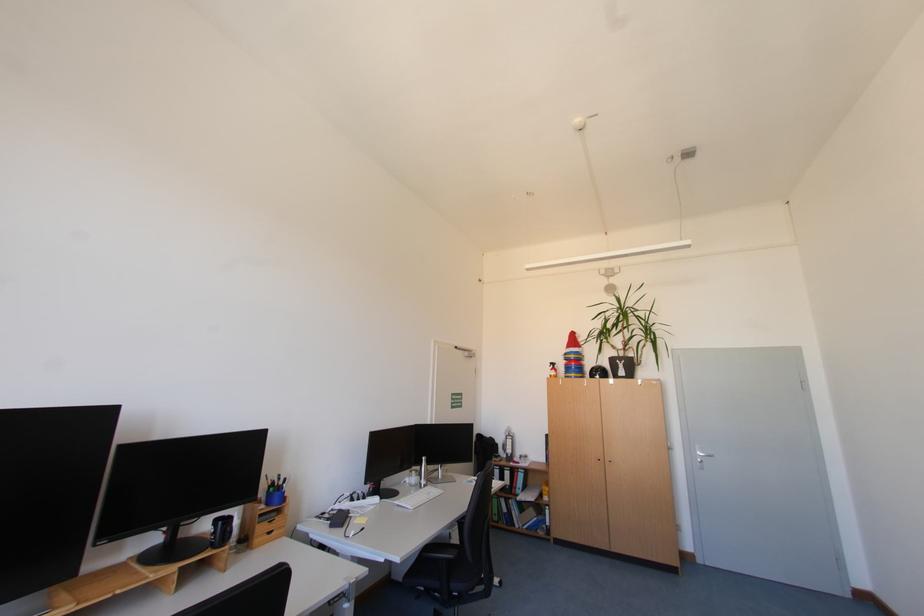
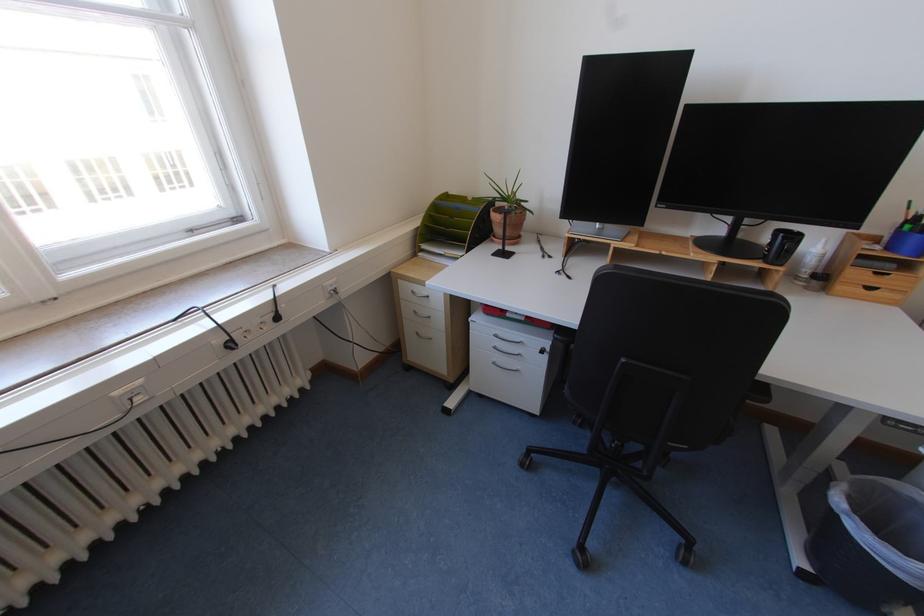
Locate, in the second image, the point that corresponds to [275,505] in the first image.

(896, 249)